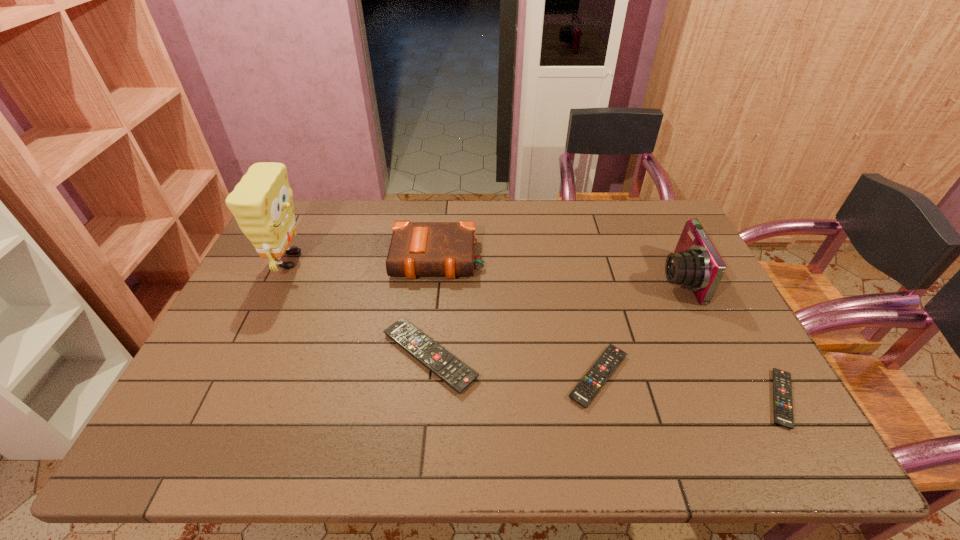
Locate an element on the screen. Image resolution: width=960 pixels, height=540 pixels. the third shortest object is located at coordinates (451, 370).

The width and height of the screenshot is (960, 540). I want to click on the leftmost remote control, so click(x=451, y=370).

Find the location of a particular element. the third object from right to left is located at coordinates (587, 388).

Locate an element on the screen. the second remote control from left to right is located at coordinates (587, 388).

Locate an element on the screen. Image resolution: width=960 pixels, height=540 pixels. the shortest remote control is located at coordinates (782, 388).

Identify the location of the rightmost remote control. (782, 388).

Find the location of `Bible`. Bible is located at coordinates (416, 249).

The image size is (960, 540). In order to click on the leftmost object in this screenshot , I will do `click(261, 202)`.

Locate an element on the screen. The image size is (960, 540). the tallest object is located at coordinates (261, 202).

Locate an element on the screen. This screenshot has height=540, width=960. camera is located at coordinates (695, 264).